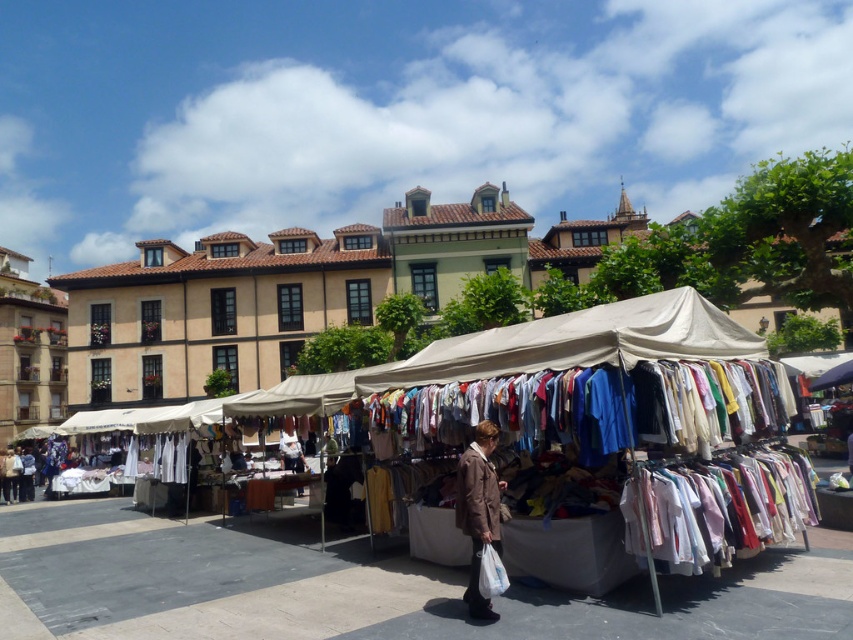
You are standing at the camera position and want to walk to the white fabric tent at center. How many steps would you need to take if each step is about 3 feet?

The white fabric tent at center is 20.39 feet away from camera. Since each step is about 3 feet, you would need approximately 7 steps to reach it.

You are standing at the market entrance and see two points marked in the scene. The first is at point (67, 612) and the second at point (461, 518). Which point is closer to you?

Point (461, 518) is closer to you because it is in front of point (67, 612).

You are a customer at the market and want to buy both the white fabric tent at center and the brown fabric coat at lower center. Which item is positioned lower in the scene?

The white fabric tent at center is positioned below the brown fabric coat at lower center, so the white fabric tent at center is lower in the scene.